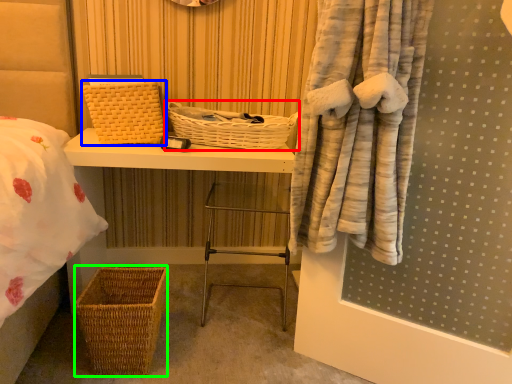
Question: Based on their relative distances, which object is farther from basket (highlighted by a red box)? Choose from basket (highlighted by a blue box) and basket (highlighted by a green box).

Choices:
 (A) basket
 (B) basket

Answer: (B)